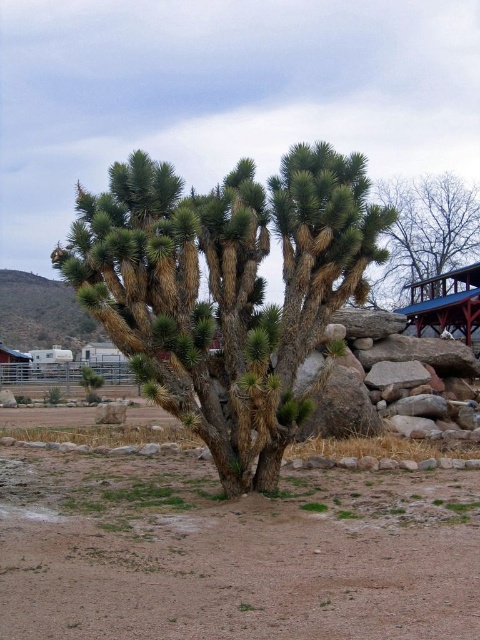
Question: Among these points, which one is nearest to the camera?

Choices:
 (A) [x=269, y=384]
 (B) [x=54, y=541]

Answer: (B)

Question: Does brown sandy dirt at center appear under brown textured tree at upper right?

Choices:
 (A) yes
 (B) no

Answer: (A)

Question: Does brown sandy dirt at center appear over green spiky tree at center?

Choices:
 (A) yes
 (B) no

Answer: (B)

Question: Based on their relative distances, which object is farther from the brown sandy dirt at center?

Choices:
 (A) green spiky tree at center
 (B) brown textured tree at upper right

Answer: (B)

Question: Which point is closer to the camera taking this photo?

Choices:
 (A) (371, 493)
 (B) (471, 218)

Answer: (A)

Question: Is brown sandy dirt at center above green spiky tree at center?

Choices:
 (A) yes
 (B) no

Answer: (B)